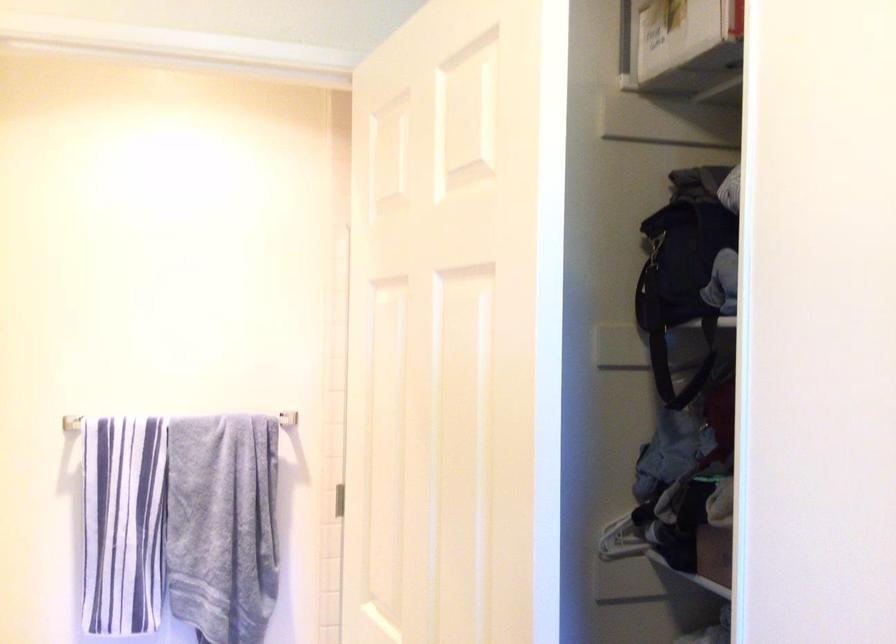
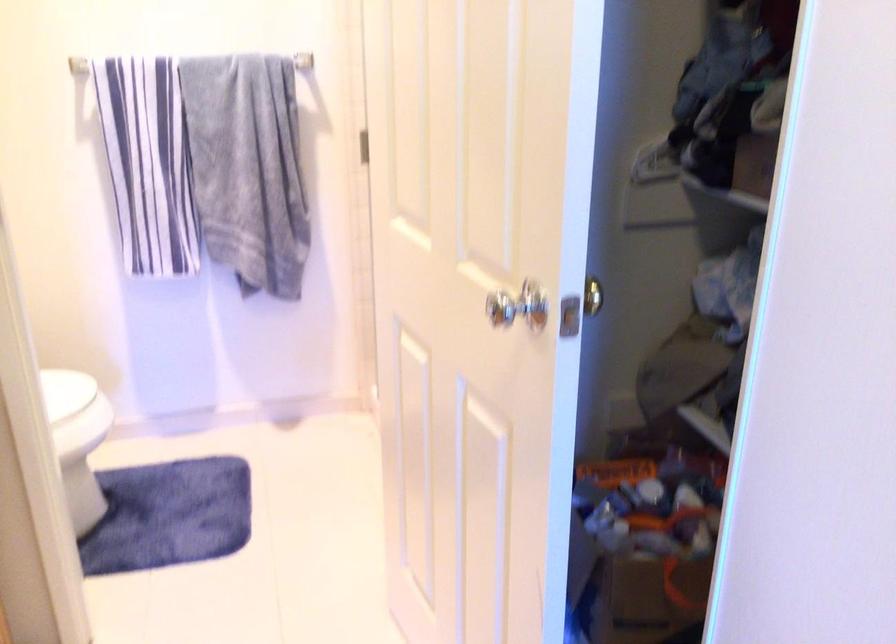
Locate, in the second image, the point that corresponds to (x=263, y=420) in the first image.

(281, 62)